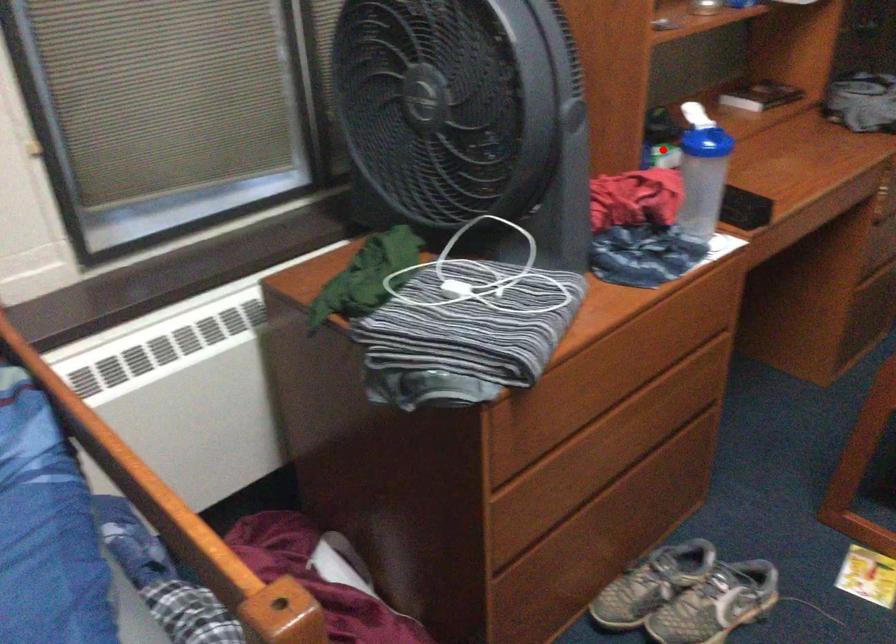
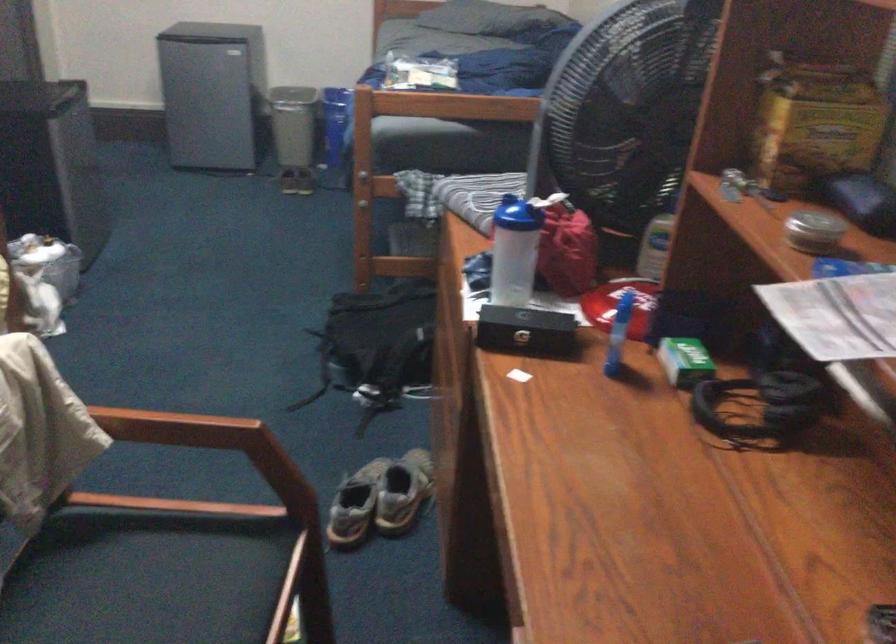
Where in the second image is the point corresponding to the highlighted location from the first image?

(685, 361)